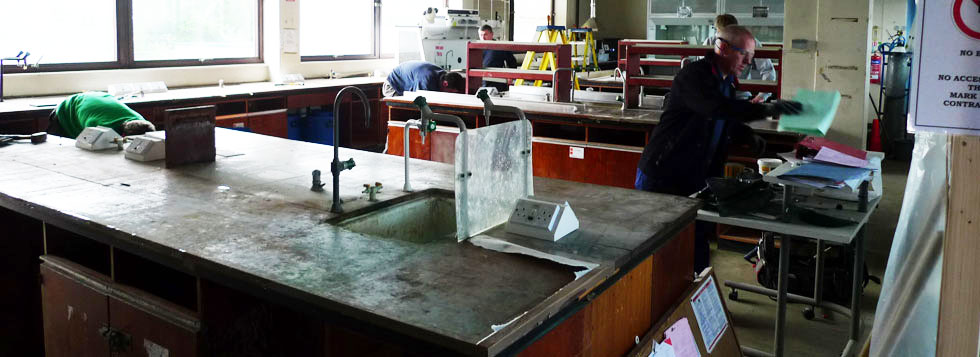
You are a GUI agent. You are given a task and a screenshot of the screen. Output one action in this format:
    pyautogui.click(x=<x>, y=<y>)
    Task: Click on the table legs
    
    Given the screenshot: What is the action you would take?
    pyautogui.click(x=817, y=273), pyautogui.click(x=782, y=299)